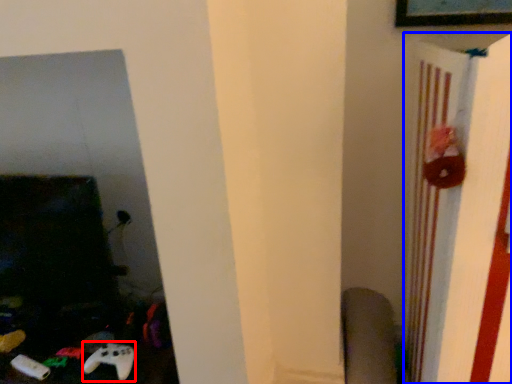
Question: Among these objects, which one is farthest to the camera, game controller (highlighted by a red box) or bulletin board (highlighted by a blue box)?

Choices:
 (A) game controller
 (B) bulletin board

Answer: (A)